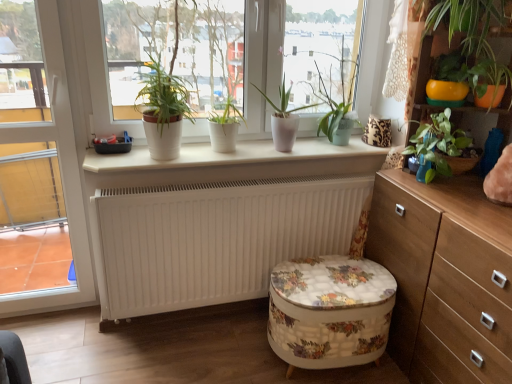
Question: Does white matte plant pots at center have a greater height compared to wooden chest of drawers at right?

Choices:
 (A) no
 (B) yes

Answer: (A)

Question: Is white matte plant pots at center shorter than wooden chest of drawers at right?

Choices:
 (A) no
 (B) yes

Answer: (B)

Question: From the image's perspective, is white matte plant pots at center above wooden chest of drawers at right?

Choices:
 (A) yes
 (B) no

Answer: (A)

Question: Are white matte plant pots at center and wooden chest of drawers at right located far from each other?

Choices:
 (A) no
 (B) yes

Answer: (B)

Question: Is the depth of white matte plant pots at center greater than that of wooden chest of drawers at right?

Choices:
 (A) yes
 (B) no

Answer: (A)

Question: In the image, is white matte pot at center, the 2th houseplant when ordered from left to right, on the left side or the right side of floral fabric ottoman at center?

Choices:
 (A) right
 (B) left

Answer: (B)

Question: Considering the positions of white matte pot at center, the 2th houseplant when ordered from left to right, and floral fabric ottoman at center in the image, is white matte pot at center, the 2th houseplant when ordered from left to right, wider or thinner than floral fabric ottoman at center?

Choices:
 (A) wide
 (B) thin

Answer: (B)

Question: From a real-world perspective, is white matte pot at center, acting as the 4th houseplant starting from the right, positioned above or below floral fabric ottoman at center?

Choices:
 (A) below
 (B) above

Answer: (B)

Question: Is white matte pot at center, acting as the 4th houseplant starting from the right, in front of or behind floral fabric ottoman at center in the image?

Choices:
 (A) front
 (B) behind

Answer: (B)

Question: Is point (252, 122) positioned closer to the camera than point (353, 339)?

Choices:
 (A) farther
 (B) closer

Answer: (A)

Question: Considering the positions of white matte plant pots at center and floral fabric ottoman at center in the image, is white matte plant pots at center bigger or smaller than floral fabric ottoman at center?

Choices:
 (A) big
 (B) small

Answer: (A)

Question: In terms of height, does white matte plant pots at center look taller or shorter compared to floral fabric ottoman at center?

Choices:
 (A) tall
 (B) short

Answer: (A)

Question: In the image, is white matte plant pots at center positioned in front of or behind floral fabric ottoman at center?

Choices:
 (A) behind
 (B) front

Answer: (B)

Question: Considering the positions of floral fabric ottoman at center and white matte pot at center, acting as the 4th houseplant starting from the right, in the image, is floral fabric ottoman at center taller or shorter than white matte pot at center, acting as the 4th houseplant starting from the right,?

Choices:
 (A) tall
 (B) short

Answer: (A)

Question: Is floral fabric ottoman at center situated inside white matte pot at center, acting as the 4th houseplant starting from the right, or outside?

Choices:
 (A) outside
 (B) inside

Answer: (A)